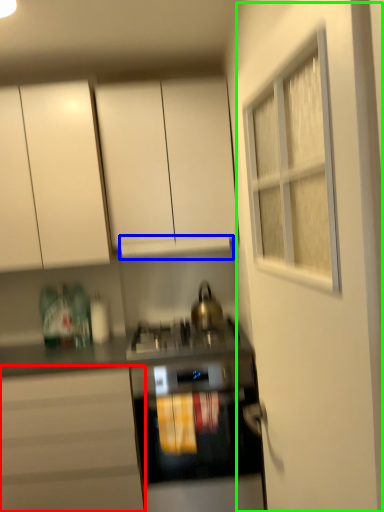
Question: Which is nearer to the cabinetry (highlighted by a red box)? exhaust hood (highlighted by a blue box) or door (highlighted by a green box).

Choices:
 (A) exhaust hood
 (B) door

Answer: (A)